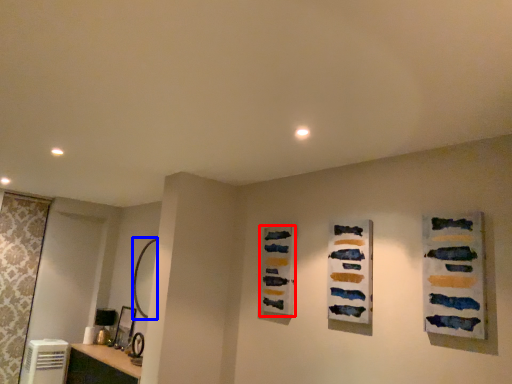
Question: Which object appears farthest to the camera in this image, art (highlighted by a red box) or mirror (highlighted by a blue box)?

Choices:
 (A) art
 (B) mirror

Answer: (B)